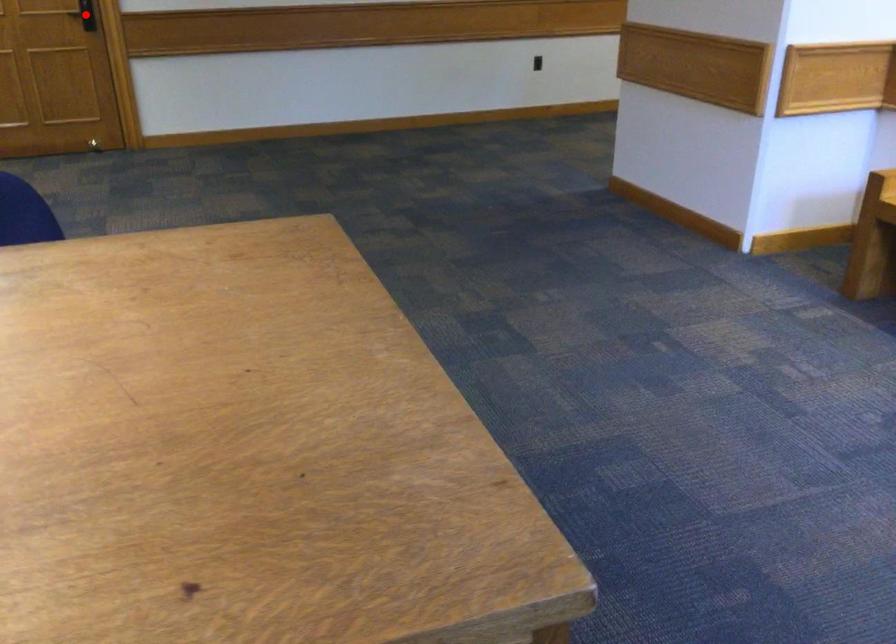
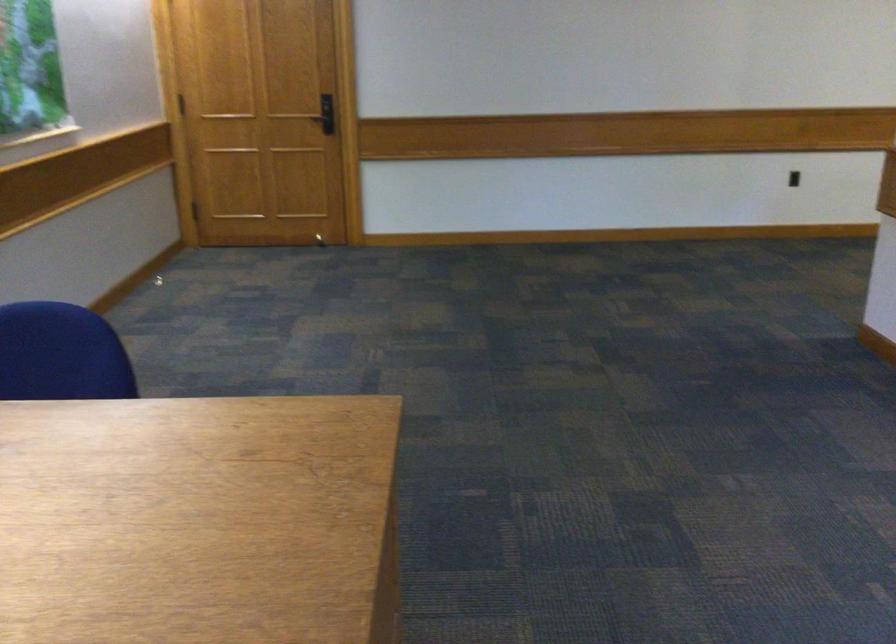
Question: I am providing you with two images of the same scene from different viewpoints. A red point is marked on the first image. At the location where the point appears in image 1, is it still visible in image 2?

Choices:
 (A) Yes
 (B) No

Answer: (B)